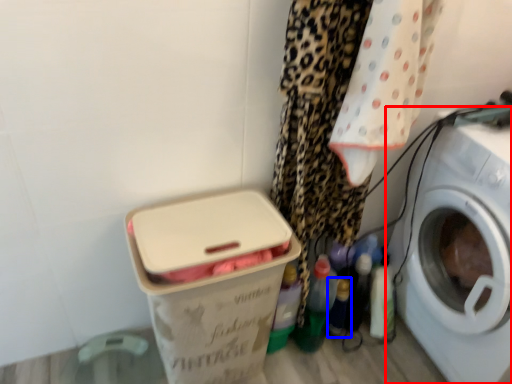
Question: Which object appears closest to the camera in this image, washing machine (highlighted by a red box) or bottle (highlighted by a blue box)?

Choices:
 (A) washing machine
 (B) bottle

Answer: (A)